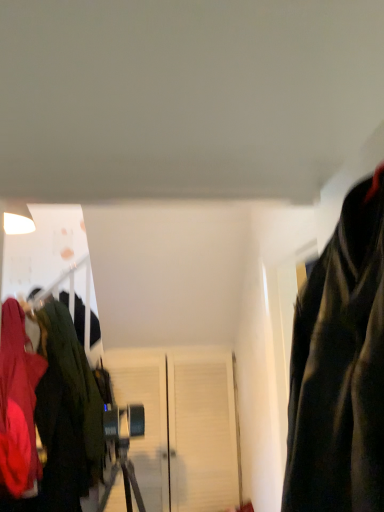
Question: Considering the relative sizes of white matte door at center and velvet green jacket at left, the second jacket when ordered from front to back, in the image provided, is white matte door at center thinner than velvet green jacket at left, the second jacket when ordered from front to back,?

Choices:
 (A) yes
 (B) no

Answer: (A)

Question: From a real-world perspective, is white matte door at center located beneath velvet green jacket at left, the second jacket when ordered from front to back?

Choices:
 (A) no
 (B) yes

Answer: (B)

Question: Can you see white matte door at center touching velvet green jacket at left, the second jacket when ordered from front to back?

Choices:
 (A) yes
 (B) no

Answer: (B)

Question: Can you confirm if white matte door at center is shorter than velvet green jacket at left, which is counted as the first jacket, starting from the back?

Choices:
 (A) no
 (B) yes

Answer: (B)

Question: Considering the relative sizes of white matte door at center and velvet green jacket at left, the second jacket when ordered from front to back, in the image provided, is white matte door at center wider than velvet green jacket at left, the second jacket when ordered from front to back,?

Choices:
 (A) yes
 (B) no

Answer: (B)

Question: Can you confirm if white matte door at center is positioned to the right of velvet green jacket at left, the second jacket when ordered from front to back?

Choices:
 (A) yes
 (B) no

Answer: (A)

Question: Is white matte door at center oriented towards matte red jacket at left, which is the 2th jacket in back-to-front order?

Choices:
 (A) yes
 (B) no

Answer: (B)

Question: Is white matte door at center looking in the opposite direction of matte red jacket at left, which is the 2th jacket in back-to-front order?

Choices:
 (A) yes
 (B) no

Answer: (B)

Question: Is white matte door at center shorter than matte red jacket at left, which is counted as the first jacket, starting from the front?

Choices:
 (A) no
 (B) yes

Answer: (B)

Question: Is white matte door at center wider than matte red jacket at left, which is the 2th jacket in back-to-front order?

Choices:
 (A) no
 (B) yes

Answer: (A)

Question: Is white matte door at center far away from matte red jacket at left, which is counted as the first jacket, starting from the front?

Choices:
 (A) no
 (B) yes

Answer: (A)

Question: From the image's perspective, does white matte door at center appear lower than matte red jacket at left, which is counted as the first jacket, starting from the front?

Choices:
 (A) yes
 (B) no

Answer: (A)

Question: Is the surface of velvet green jacket at left, which is counted as the first jacket, starting from the back, in direct contact with white matte door at center?

Choices:
 (A) no
 (B) yes

Answer: (A)